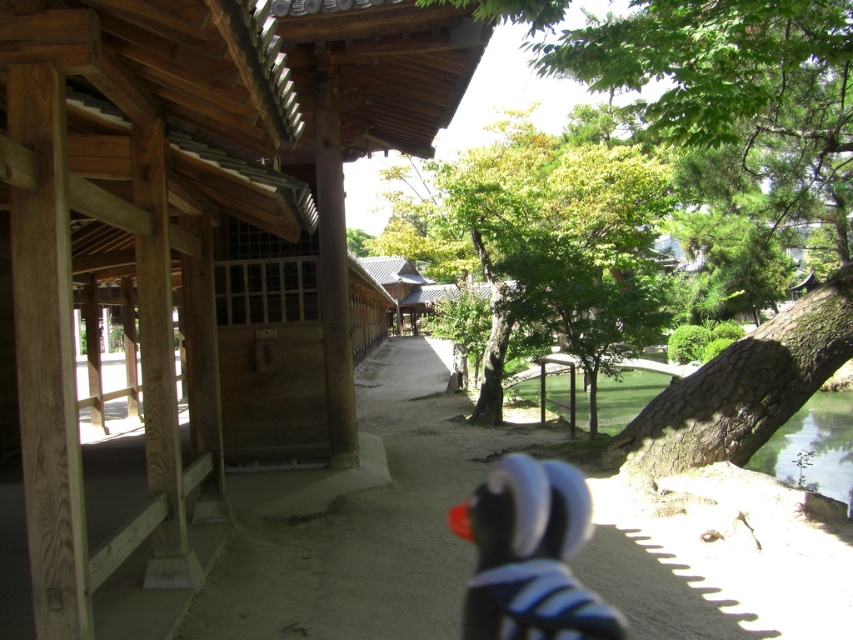
Is wooden hut at center thinner than green leafy tree at center?

Indeed, wooden hut at center has a lesser width compared to green leafy tree at center.

Between point (50, 156) and point (697, 426), which one is positioned behind?

The point (697, 426) is more distant.

Find the location of a particular element. This screenshot has height=640, width=853. wooden hut at center is located at coordinates (190, 237).

Can you confirm if wooden hut at center is positioned to the left of black rubber duck at center?

Yes, wooden hut at center is to the left of black rubber duck at center.

From the picture: Which is below, wooden hut at center or black rubber duck at center?

Positioned lower is black rubber duck at center.

Is point (231, 29) closer to viewer compared to point (498, 636)?

Yes, it is in front of point (498, 636).

Where is `wooden hut at center`? The width and height of the screenshot is (853, 640). wooden hut at center is located at coordinates (190, 237).

Does point (781, 52) lie behind point (564, 577)?

No, it is in front of (564, 577).

Does green leafy tree at center have a smaller size compared to black rubber duck at center?

No.

Which is behind, point (654, 74) or point (467, 616)?

Point (654, 74)

Locate an element on the screen. This screenshot has width=853, height=640. green leafy tree at center is located at coordinates (738, 192).